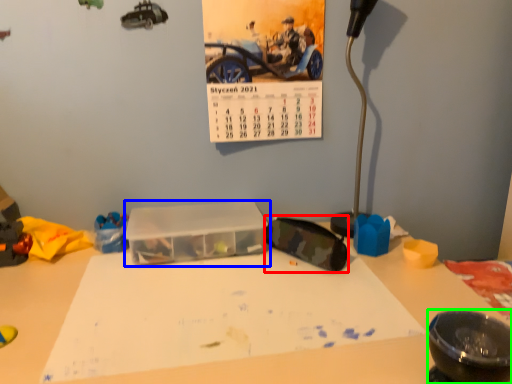
Question: Which is nearer to the goggles (highlighted by a red box)? glass box (highlighted by a blue box) or bowl (highlighted by a green box).

Choices:
 (A) glass box
 (B) bowl

Answer: (A)